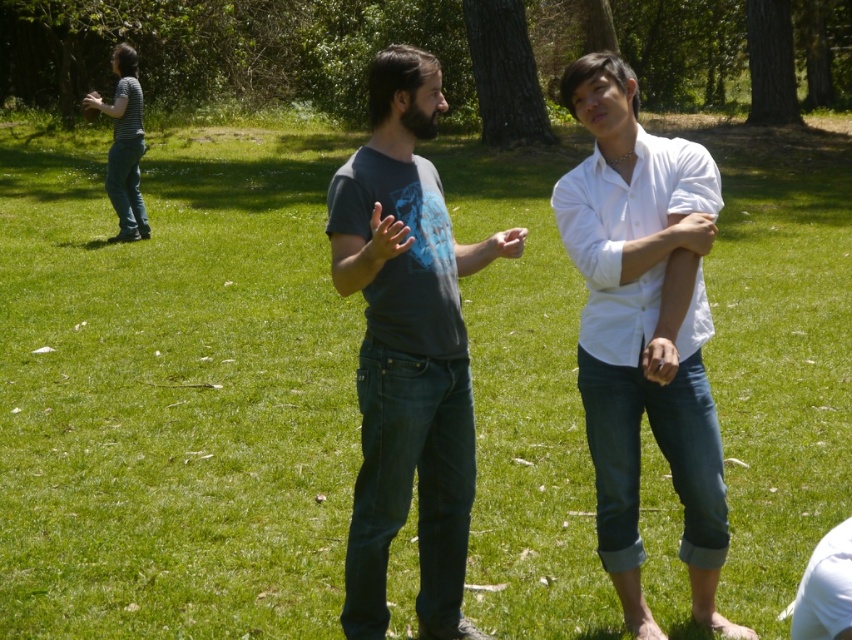
Question: Which point is closer to the camera taking this photo?

Choices:
 (A) (412, 317)
 (B) (586, 435)

Answer: (A)

Question: Which point is farther to the camera?

Choices:
 (A) matte gray t-shirt at center
 (B) white cotton shirt at center

Answer: (B)

Question: Does white cotton shirt at center appear on the left side of matte gray t-shirt at center?

Choices:
 (A) no
 (B) yes

Answer: (A)

Question: Considering the relative positions of white cotton shirt at center and matte gray t-shirt at center in the image provided, where is white cotton shirt at center located with respect to matte gray t-shirt at center?

Choices:
 (A) right
 (B) left

Answer: (A)

Question: Does white cotton shirt at center lie behind matte gray t-shirt at center?

Choices:
 (A) no
 (B) yes

Answer: (B)